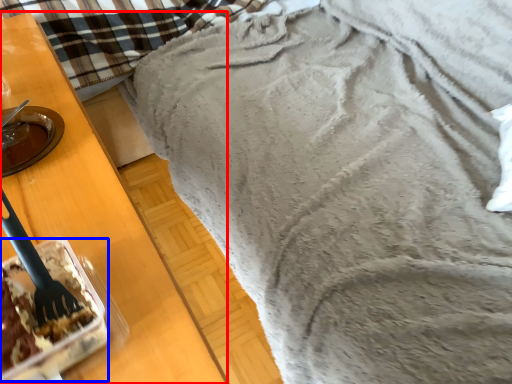
Question: Among these objects, which one is nearest to the camera, furniture (highlighted by a red box) or dessert (highlighted by a blue box)?

Choices:
 (A) furniture
 (B) dessert

Answer: (A)